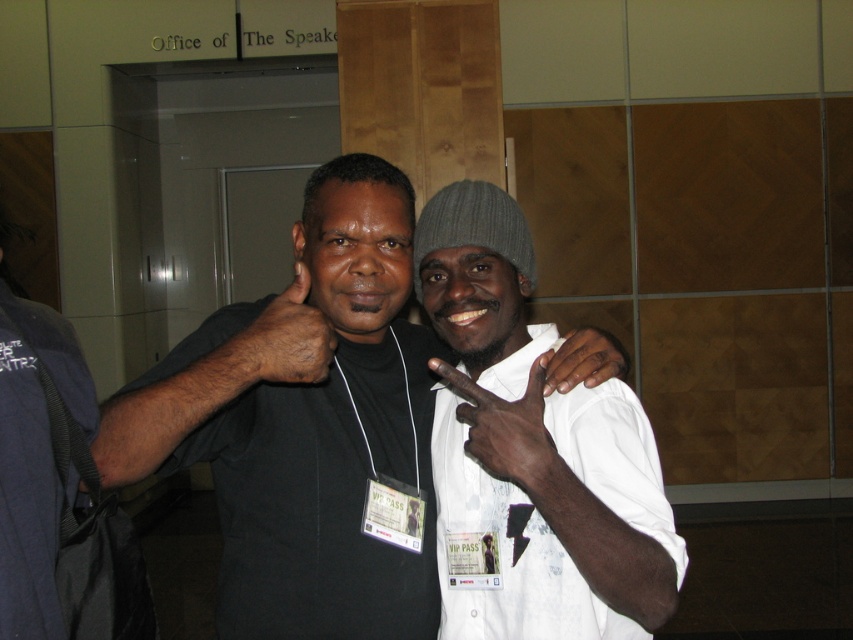
Question: Which point is farther to the camera?

Choices:
 (A) dark skin/hair at center
 (B) black matte shirt at center

Answer: (A)

Question: Can you confirm if white matte shirt at center is bigger than dark skin/hair at center?

Choices:
 (A) no
 (B) yes

Answer: (B)

Question: In this image, where is black matte hand at center located relative to dark skin/hair at center?

Choices:
 (A) right
 (B) left

Answer: (A)

Question: Does white matte shirt at center appear under black matte hand at center?

Choices:
 (A) yes
 (B) no

Answer: (A)

Question: Which object is closer to the camera taking this photo?

Choices:
 (A) black matte shirt at center
 (B) white matte shirt at center
 (C) dark skin/hair at center

Answer: (A)

Question: Which point is closer to the camera taking this photo?

Choices:
 (A) (456, 380)
 (B) (598, 332)

Answer: (A)